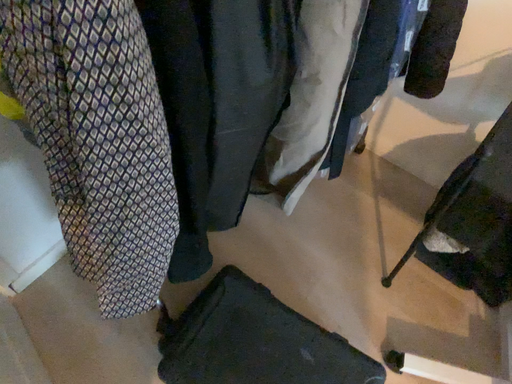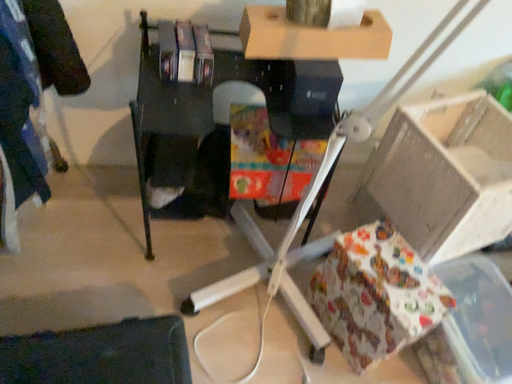
Question: Which way did the camera rotate in the video?

Choices:
 (A) rotated upward
 (B) rotated downward

Answer: (A)